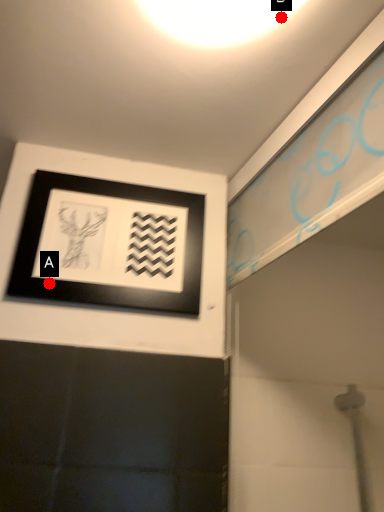
Question: Two points are circled on the image, labeled by A and B beside each circle. Which point is further to the camera?

Choices:
 (A) A is further
 (B) B is further

Answer: (A)